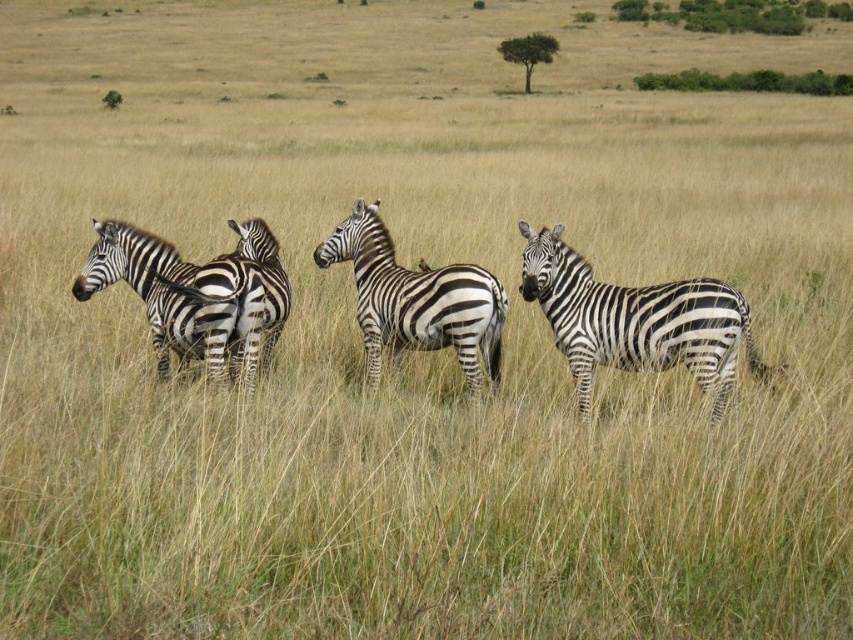
Can you confirm if black and white striped zebra at right is positioned to the right of black and white striped zebra at center?

Yes, black and white striped zebra at right is to the right of black and white striped zebra at center.

Does black and white striped zebra at right appear on the left side of black and white striped zebra at center?

No, black and white striped zebra at right is not to the left of black and white striped zebra at center.

What do you see at coordinates (636, 321) in the screenshot? The height and width of the screenshot is (640, 853). I see `black and white striped zebra at right` at bounding box center [636, 321].

Find the location of a particular element. black and white striped zebra at right is located at coordinates (636, 321).

Is the position of black and white striped zebras at left more distant than that of black and white striped zebra at right?

That is True.

Is black and white striped zebras at left wider than black and white striped zebra at right?

Incorrect, black and white striped zebras at left's width does not surpass black and white striped zebra at right's.

Describe the element at coordinates (636, 321) in the screenshot. This screenshot has height=640, width=853. I see `black and white striped zebras at left` at that location.

The image size is (853, 640). Find the location of `black and white striped zebras at left`. black and white striped zebras at left is located at coordinates (636, 321).

Is black and white striped zebras at left bigger than black and white striped zebra at left?

No, black and white striped zebras at left is not bigger than black and white striped zebra at left.

Can you confirm if black and white striped zebras at left is smaller than black and white striped zebra at left?

Yes.

Measure the distance between point (579, 307) and camera.

The distance of point (579, 307) from camera is 5.63 meters.

Find the location of a particular element. black and white striped zebras at left is located at coordinates (636, 321).